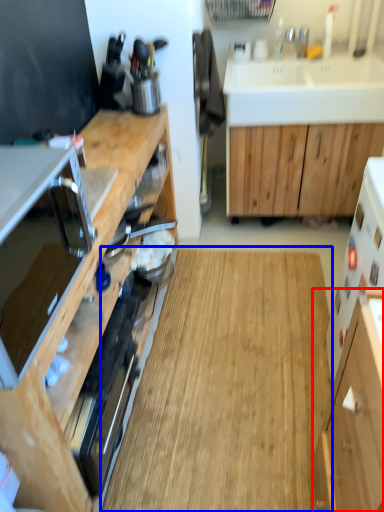
Question: Which of the following is the farthest to the observer, cabinetry (highlighted by a red box) or hardwood (highlighted by a blue box)?

Choices:
 (A) cabinetry
 (B) hardwood

Answer: (B)